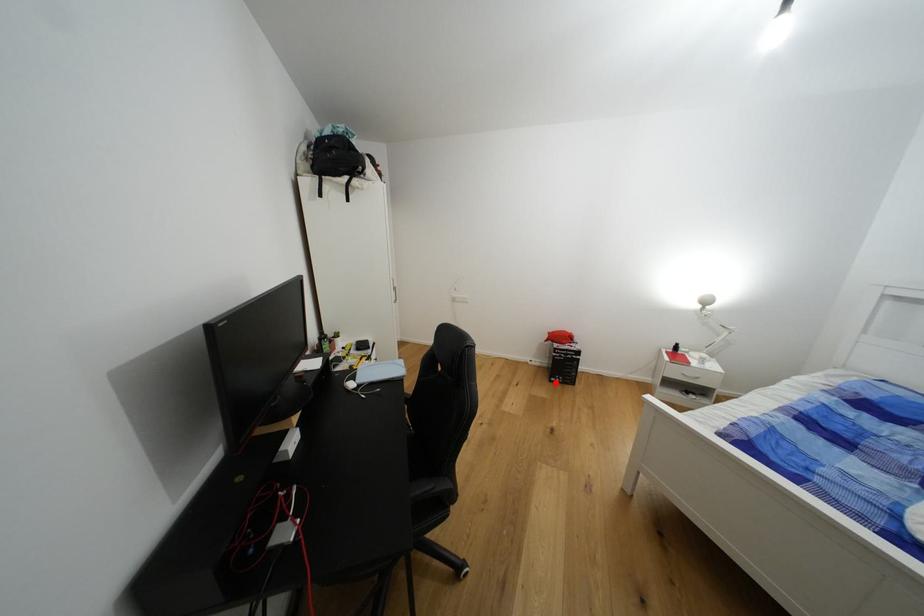
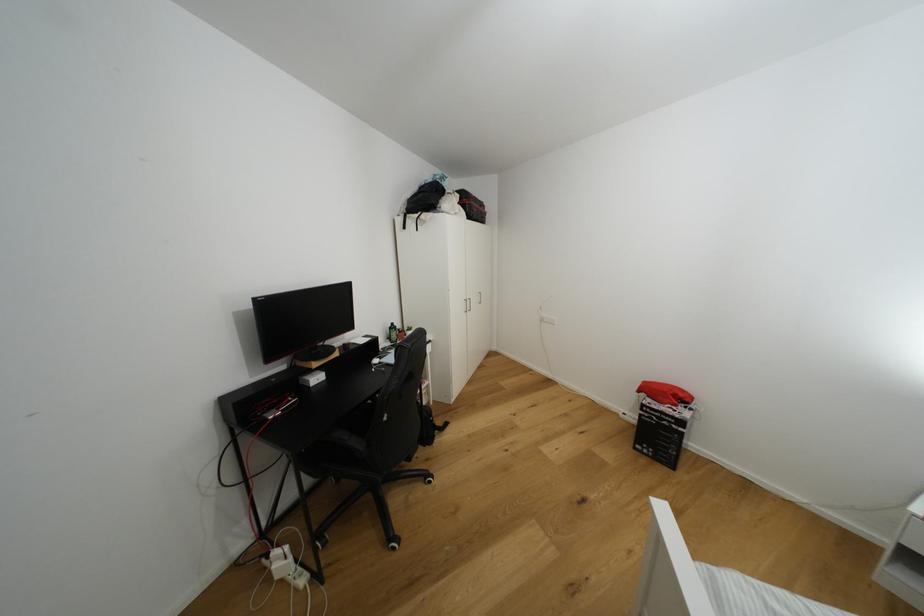
Question: A red point is marked in image1. In image2, is the corresponding 3D point closer to the camera or farther? Reply with the corresponding letter.

Choices:
 (A) The corresponding 3D point is closer.
 (B) The corresponding 3D point is farther.

Answer: (B)